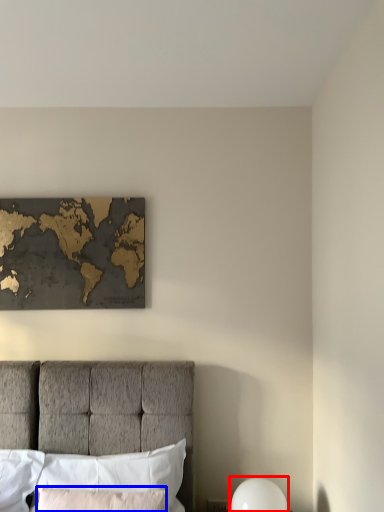
Question: Which object is further to the camera taking this photo, bedside lamp (highlighted by a red box) or pillow (highlighted by a blue box)?

Choices:
 (A) bedside lamp
 (B) pillow

Answer: (A)